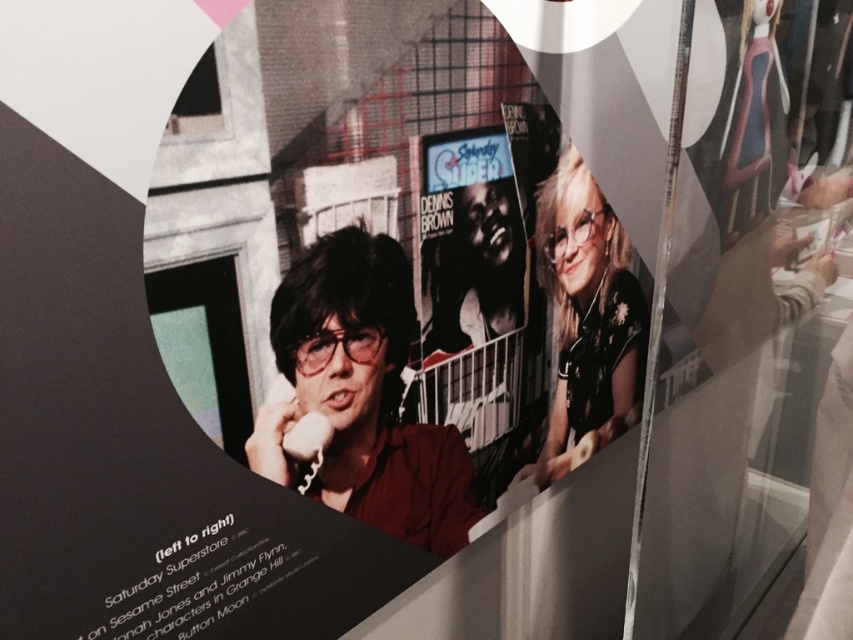
Question: Does matte black glasses at center have a greater width compared to black glossy poster at center?

Choices:
 (A) no
 (B) yes

Answer: (B)

Question: Which of these objects is positioned farthest from the black glossy poster at center?

Choices:
 (A) matte black man at center
 (B) matte black glasses at center

Answer: (B)

Question: Which point is closer to the camera?

Choices:
 (A) matte black glasses at center
 (B) black glossy poster at center
 (C) matte black man at center

Answer: (C)

Question: Which point is farther to the camera?

Choices:
 (A) matte black man at center
 (B) black glossy poster at center
 (C) matte black glasses at center

Answer: (C)

Question: Is matte black glasses at center in front of black glossy poster at center?

Choices:
 (A) yes
 (B) no

Answer: (B)

Question: Can you confirm if matte black man at center is wider than black glossy poster at center?

Choices:
 (A) no
 (B) yes

Answer: (B)